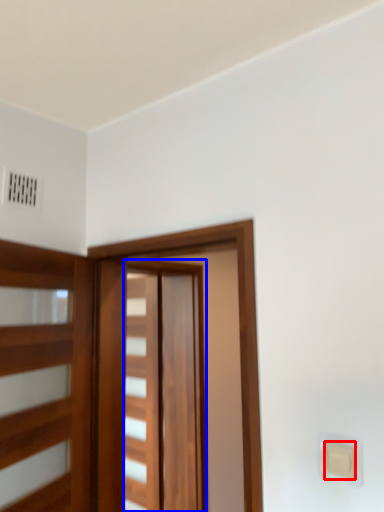
Question: Which of the following is the farthest to the observer, light switch (highlighted by a red box) or barn door (highlighted by a blue box)?

Choices:
 (A) light switch
 (B) barn door

Answer: (B)